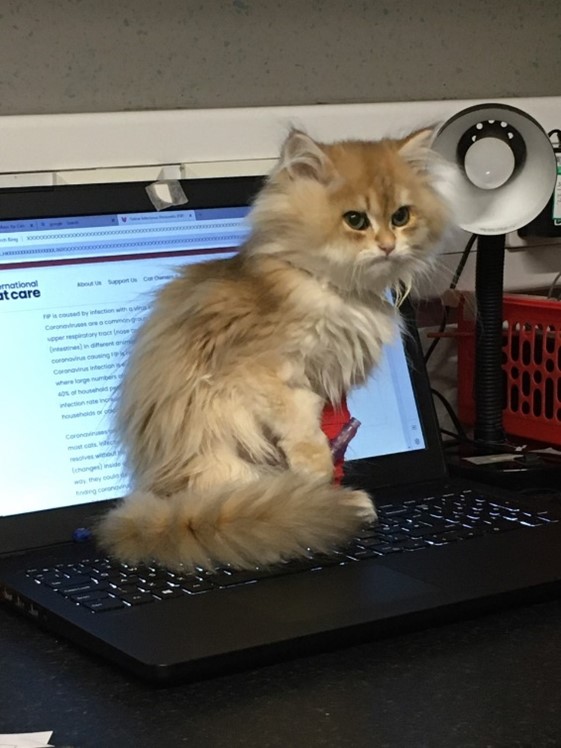
At what (x,y) coordinates should I click in order to perform the action: click on black keyboard. Please return your answer as a coordinate pair (x, y). The width and height of the screenshot is (561, 748). Looking at the image, I should click on (346, 565).